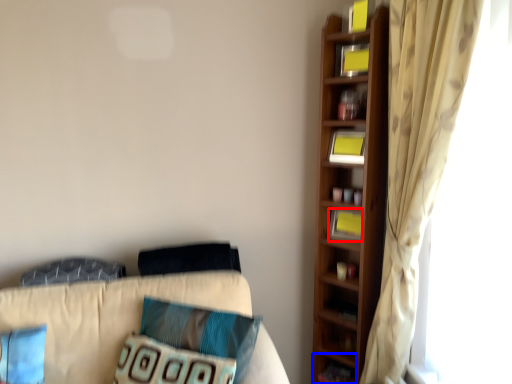
Question: Which object is further to the camera taking this photo, book (highlighted by a red box) or cabinet (highlighted by a blue box)?

Choices:
 (A) book
 (B) cabinet

Answer: (B)